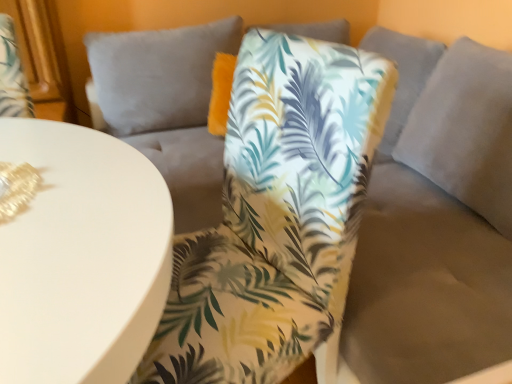
Question: Considering their positions, is palm leaf fabric chair at center located in front of or behind white glossy table at lower left?

Choices:
 (A) front
 (B) behind

Answer: (B)

Question: Would you say palm leaf fabric chair at center is to the left or to the right of white glossy table at lower left in the picture?

Choices:
 (A) right
 (B) left

Answer: (A)

Question: From the image's perspective, is palm leaf fabric chair at center above or below white glossy table at lower left?

Choices:
 (A) above
 (B) below

Answer: (A)

Question: Relative to palm leaf fabric chair at center, is white glossy table at lower left in front or behind?

Choices:
 (A) front
 (B) behind

Answer: (A)

Question: In the image, is white glossy table at lower left on the left side or the right side of palm leaf fabric chair at center?

Choices:
 (A) right
 (B) left

Answer: (B)

Question: Is white glossy table at lower left spatially inside palm leaf fabric chair at center, or outside of it?

Choices:
 (A) inside
 (B) outside

Answer: (B)

Question: Is white glossy table at lower left taller or shorter than palm leaf fabric chair at center?

Choices:
 (A) short
 (B) tall

Answer: (A)